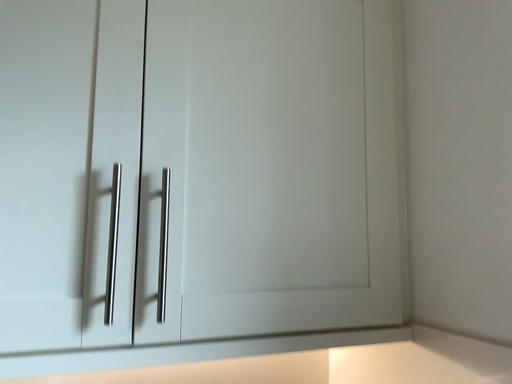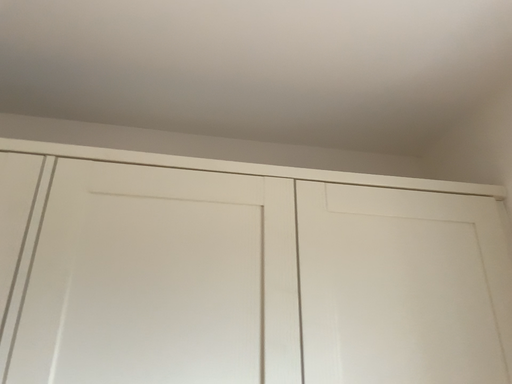
Question: How did the camera likely rotate when shooting the video?

Choices:
 (A) rotated left
 (B) rotated right

Answer: (A)